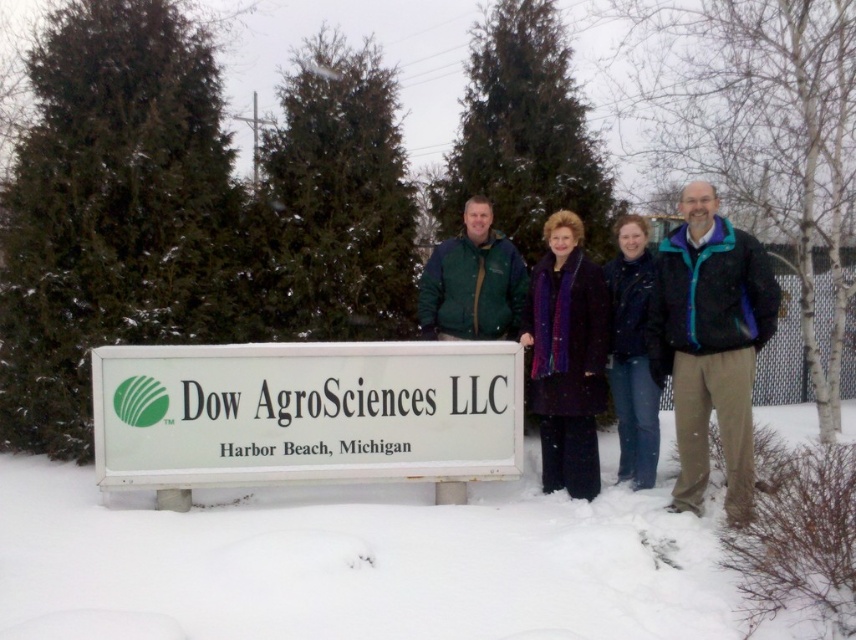
You are a photographer trying to capture a group photo of the purple wool coat at center and the white plastic sign at center. Since you want the sign to be on the left side of the coat in the photo, is the current arrangement already suitable?

Yes, the current arrangement is suitable because the white plastic sign at center is already positioned on the left side of the purple wool coat at center, which matches your desired composition.

You are standing at the origin point of the coordinate system where the purple wool coat at center is located at point 0.558, 0.664. If you want to walk directly towards the Dow AgroSciences LLC sign, which is located at the origin, would you be walking towards or away from the sign?

The purple wool coat at center is located at point (568, 356), which is away from the origin point where the sign is located. Therefore, walking directly towards the origin would mean walking towards the sign.